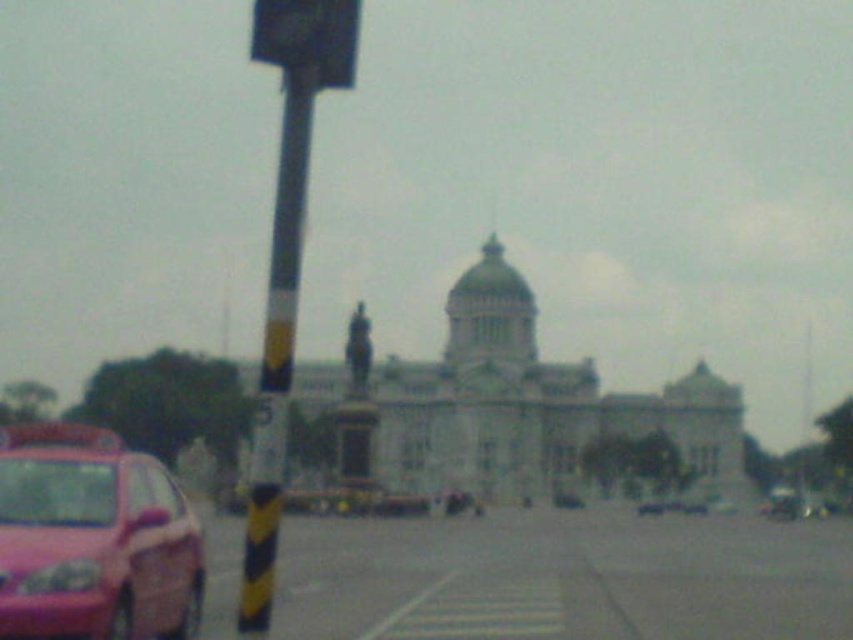
You are a pedestrian standing at the intersection and want to cross the street. The pink glossy car at lower left is blocking your path. Can you see the dark gray plastic traffic light at upper center from your current position?

Yes, because the pink glossy car at lower left is positioned under the dark gray plastic traffic light at upper center, so the traffic light is above the car and visible from your position.

You are a pedestrian standing at the crosswalk and see the yellow and black striped pole at left and the pink matte car at lower left. Which object is closer to you?

The yellow and black striped pole at left is closer to you because it is positioned over the pink matte car at lower left, indicating it is in front of the car.